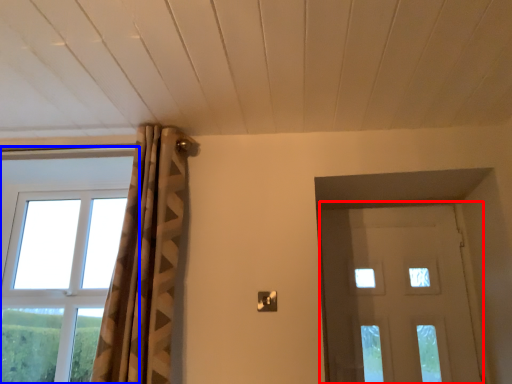
Question: Which object appears farthest to the camera in this image, door (highlighted by a red box) or window (highlighted by a blue box)?

Choices:
 (A) door
 (B) window

Answer: (B)